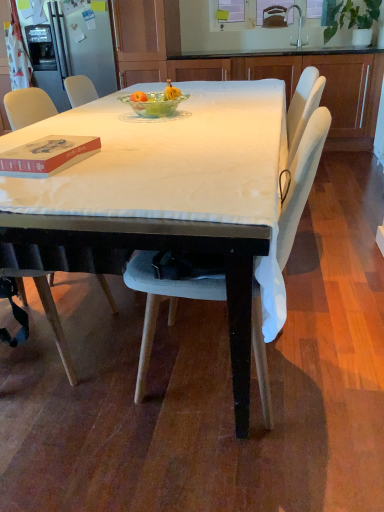
Question: Based on their sizes in the image, would you say green leafy plant at upper right is bigger or smaller than silver metallic faucet at upper center?

Choices:
 (A) big
 (B) small

Answer: (A)

Question: Is green leafy plant at upper right in front of or behind silver metallic faucet at upper center in the image?

Choices:
 (A) front
 (B) behind

Answer: (A)

Question: Based on their relative distances, which object is nearer to the matte red book at left?

Choices:
 (A) light gray fabric chair at center
 (B) white fabric-covered table at center
 (C) silver metallic faucet at upper center
 (D) translucent glass bowl at center
 (E) green leafy plant at upper right

Answer: (B)

Question: Which is farther from the translucent glass bowl at center?

Choices:
 (A) green leafy plant at upper right
 (B) white fabric-covered table at center
 (C) white wood cabinets at center
 (D) matte red book at left
 (E) silver metallic faucet at upper center

Answer: (E)